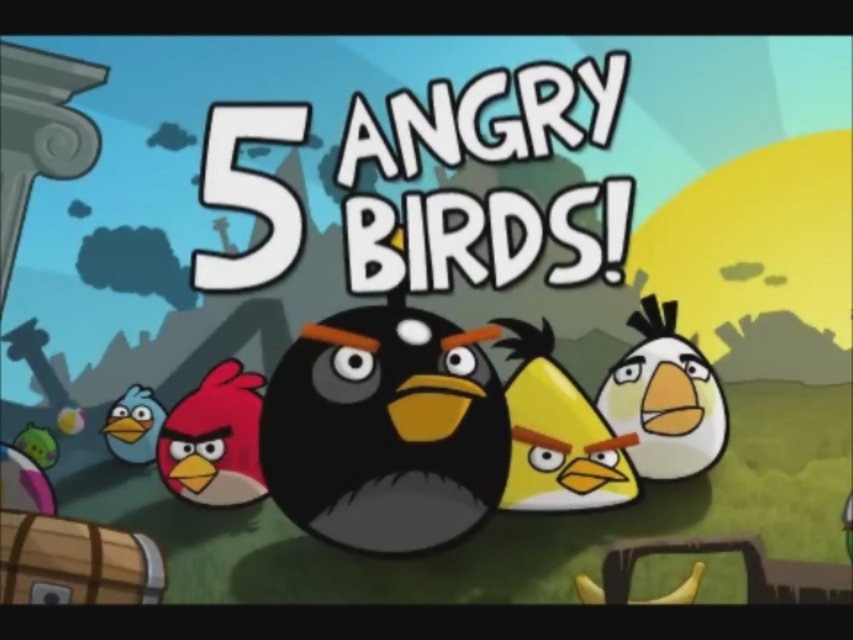
In the Angry Birds scene, you see the black matte bird at center and the matte pink bird at left. Which bird is larger in size?

The black matte bird at center is bigger than the matte pink bird at left.

In the scene shown: In the Angry Birds scene, there are two birds visible. The black matte bird at center and the matte pink bird at left. Which bird is taller?

The black matte bird at center is taller than the matte pink bird at left.